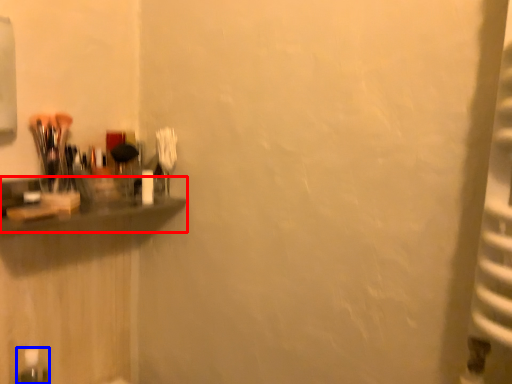
Question: Which object appears closest to the camera in this image, shelf (highlighted by a red box) or bottle (highlighted by a blue box)?

Choices:
 (A) shelf
 (B) bottle

Answer: (A)